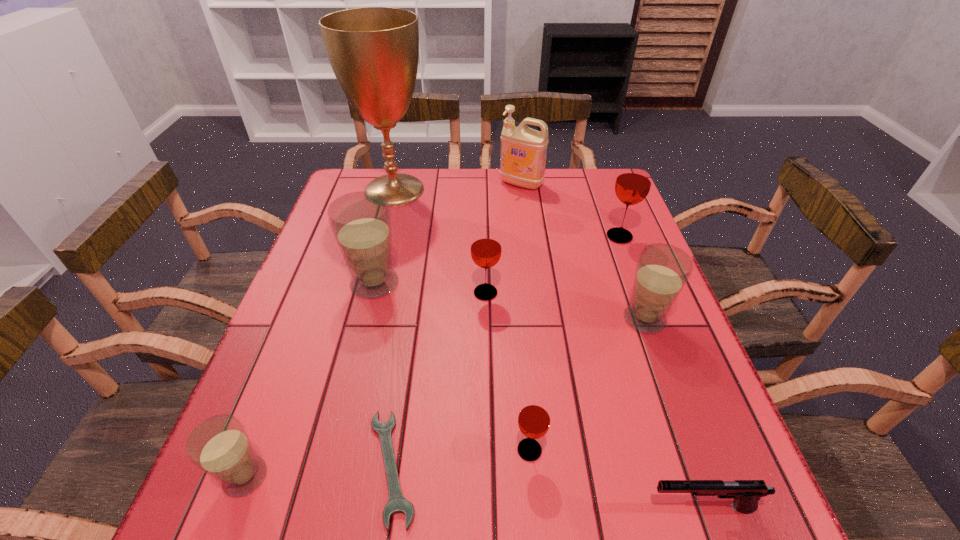
Locate an element on the screen. This screenshot has width=960, height=540. the fourth glass from left to right is located at coordinates (534, 418).

Where is `the smallest blue glass`? This screenshot has width=960, height=540. the smallest blue glass is located at coordinates (219, 446).

The width and height of the screenshot is (960, 540). Identify the location of the nearest blue glass. (219, 446).

Locate an element on the screen. black gun is located at coordinates (746, 493).

Where is `gun`? This screenshot has width=960, height=540. gun is located at coordinates (746, 493).

This screenshot has height=540, width=960. Identify the location of the shortest object. (397, 503).

Locate an element on the screen. The width and height of the screenshot is (960, 540). free space located 0.180m on the right of the tallest object is located at coordinates (489, 190).

Identify the location of free region located on the left of the beige detergent. This screenshot has width=960, height=540. (444, 184).

At what (x,y) coordinates should I click in order to perform the action: click on free location located on the front of the farthest glass. Please return your answer as a coordinate pair (x, y). The width and height of the screenshot is (960, 540). Looking at the image, I should click on (628, 259).

You are a GUI agent. You are given a task and a screenshot of the screen. Output one action in this format:
    pyautogui.click(x=<x>, y=<y>)
    Task: Click on the vacant area situated 0.310m on the front of the biggest blue glass
    The image size is (960, 540).
    Given the screenshot: What is the action you would take?
    pyautogui.click(x=339, y=424)